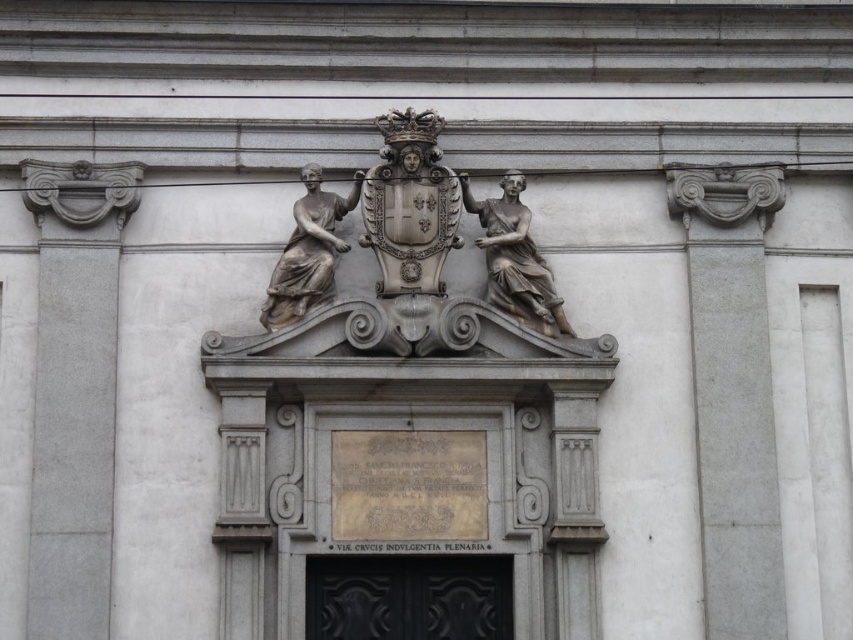
Question: Which point is closer to the camera taking this photo?

Choices:
 (A) (486, 628)
 (B) (344, 244)
 (C) (560, 308)
 (D) (39, 408)

Answer: (D)

Question: Which of the following is the farthest from the observer?

Choices:
 (A) (270, 305)
 (B) (538, 307)

Answer: (B)

Question: Is sandy brown stone statue at center to the right of silver metallic statue at center from the viewer's perspective?

Choices:
 (A) yes
 (B) no

Answer: (A)

Question: Which of the following is the farthest from the observer?

Choices:
 (A) (260, 317)
 (B) (489, 248)

Answer: (B)

Question: Can you confirm if sandy brown stone statue at center is wider than silver metallic statue at center?

Choices:
 (A) no
 (B) yes

Answer: (A)

Question: Is white stone column at left to the left of black polished wood door at center from the viewer's perspective?

Choices:
 (A) no
 (B) yes

Answer: (B)